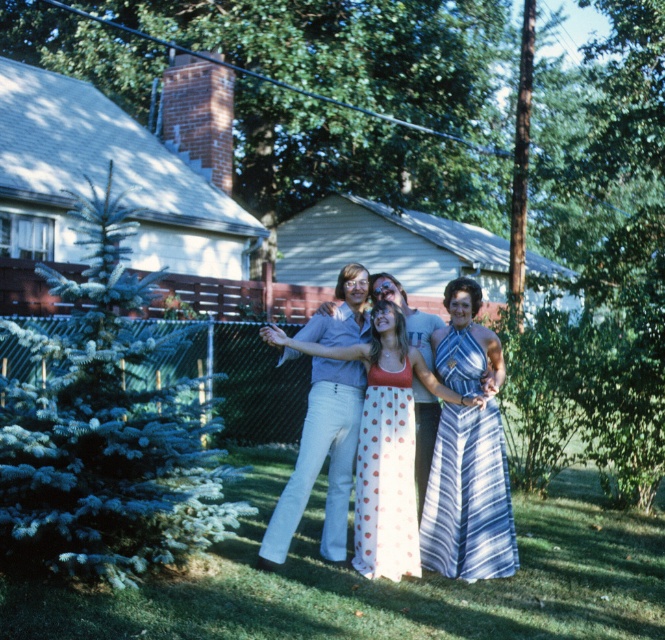
Can you confirm if blue striped dress at center is positioned above white polka dot fabric dress at center?

Yes.

Does blue striped dress at center have a smaller size compared to white polka dot fabric dress at center?

No, blue striped dress at center is not smaller than white polka dot fabric dress at center.

Identify the location of blue striped dress at center. (467, 497).

Image resolution: width=665 pixels, height=640 pixels. I want to click on blue striped dress at center, so click(467, 497).

Between blue striped dress at center and white cotton pants at center, which one appears on the right side from the viewer's perspective?

blue striped dress at center is more to the right.

Who is shorter, blue striped dress at center or white cotton pants at center?

blue striped dress at center

Is point (434, 532) positioned in front of point (319, 394)?

No, (434, 532) is behind (319, 394).

This screenshot has width=665, height=640. Identify the location of blue striped dress at center. (467, 497).

Image resolution: width=665 pixels, height=640 pixels. What do you see at coordinates (414, 449) in the screenshot? I see `polka dot dress at center` at bounding box center [414, 449].

The height and width of the screenshot is (640, 665). What are the coordinates of `polka dot dress at center` in the screenshot? It's located at (414, 449).